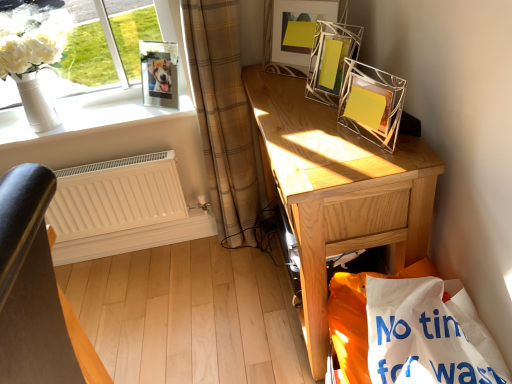
Question: Does light brown wooden desk at right appear on the right side of metallic wire picture frame at upper right, the 3th picture frame from the left?

Choices:
 (A) no
 (B) yes

Answer: (A)

Question: Is light brown wooden desk at right taller than metallic wire picture frame at upper right, the 3th picture frame from the left?

Choices:
 (A) yes
 (B) no

Answer: (A)

Question: Is light brown wooden desk at right smaller than metallic wire picture frame at upper right, the 3th picture frame from the left?

Choices:
 (A) no
 (B) yes

Answer: (A)

Question: Is light brown wooden desk at right further to the viewer compared to metallic wire picture frame at upper right, arranged as the 1th picture frame when viewed from the right?

Choices:
 (A) yes
 (B) no

Answer: (B)

Question: From the image's perspective, is light brown wooden desk at right above metallic wire picture frame at upper right, arranged as the 1th picture frame when viewed from the right?

Choices:
 (A) yes
 (B) no

Answer: (B)

Question: Considering the positions of white paper shopping bag at lower right and metallic wire picture frame at upper center, the 2th picture frame from the left, in the image, is white paper shopping bag at lower right bigger or smaller than metallic wire picture frame at upper center, the 2th picture frame from the left,?

Choices:
 (A) small
 (B) big

Answer: (B)

Question: Choose the correct answer: Is white paper shopping bag at lower right inside metallic wire picture frame at upper center, which ranks as the second picture frame in right-to-left order, or outside it?

Choices:
 (A) inside
 (B) outside

Answer: (B)

Question: From a real-world perspective, is white paper shopping bag at lower right physically located above or below metallic wire picture frame at upper center, the 2th picture frame from the left?

Choices:
 (A) below
 (B) above

Answer: (A)

Question: Considering the positions of point (352, 360) and point (287, 62), is point (352, 360) closer or farther from the camera than point (287, 62)?

Choices:
 (A) closer
 (B) farther

Answer: (A)

Question: Is clear glass photo frame at upper left, which ranks as the first picture frame in left-to-right order, to the left or to the right of metallic wire picture frame at upper center, the 2th picture frame from the left, in the image?

Choices:
 (A) right
 (B) left

Answer: (B)

Question: Looking at the image, does clear glass photo frame at upper left, the third picture frame positioned from the right, seem bigger or smaller compared to metallic wire picture frame at upper center, which ranks as the second picture frame in right-to-left order?

Choices:
 (A) big
 (B) small

Answer: (B)

Question: Considering the positions of clear glass photo frame at upper left, the third picture frame positioned from the right, and metallic wire picture frame at upper center, which ranks as the second picture frame in right-to-left order, in the image, is clear glass photo frame at upper left, the third picture frame positioned from the right, taller or shorter than metallic wire picture frame at upper center, which ranks as the second picture frame in right-to-left order,?

Choices:
 (A) short
 (B) tall

Answer: (A)

Question: Looking at their shapes, would you say clear glass photo frame at upper left, which ranks as the first picture frame in left-to-right order, is wider or thinner than metallic wire picture frame at upper center, which ranks as the second picture frame in right-to-left order?

Choices:
 (A) thin
 (B) wide

Answer: (B)

Question: Would you say white paper shopping bag at lower right is inside or outside beige plaid curtain at left?

Choices:
 (A) outside
 (B) inside

Answer: (A)

Question: Considering their positions, is white paper shopping bag at lower right located in front of or behind beige plaid curtain at left?

Choices:
 (A) behind
 (B) front

Answer: (B)